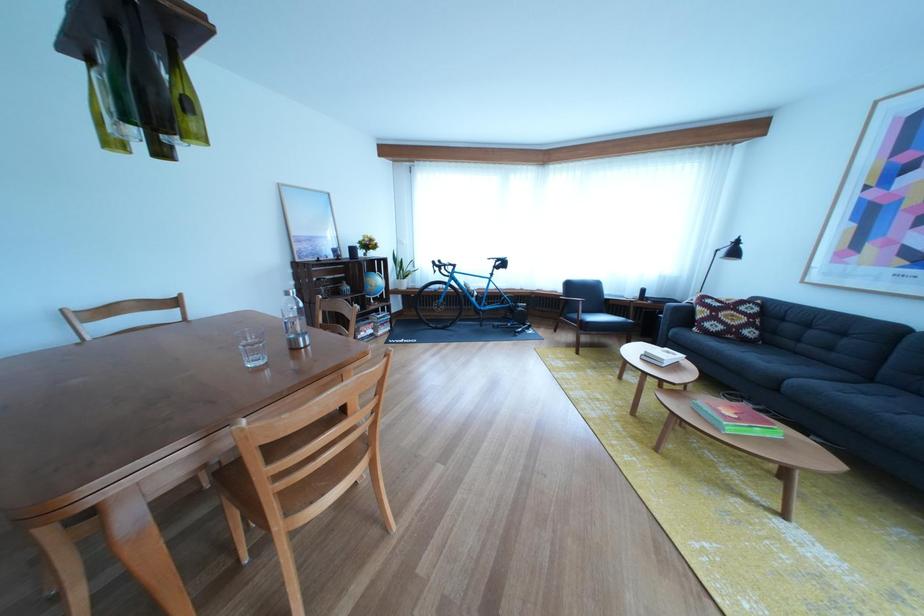
What do you see at coordinates (733, 249) in the screenshot?
I see `a black lamp head` at bounding box center [733, 249].